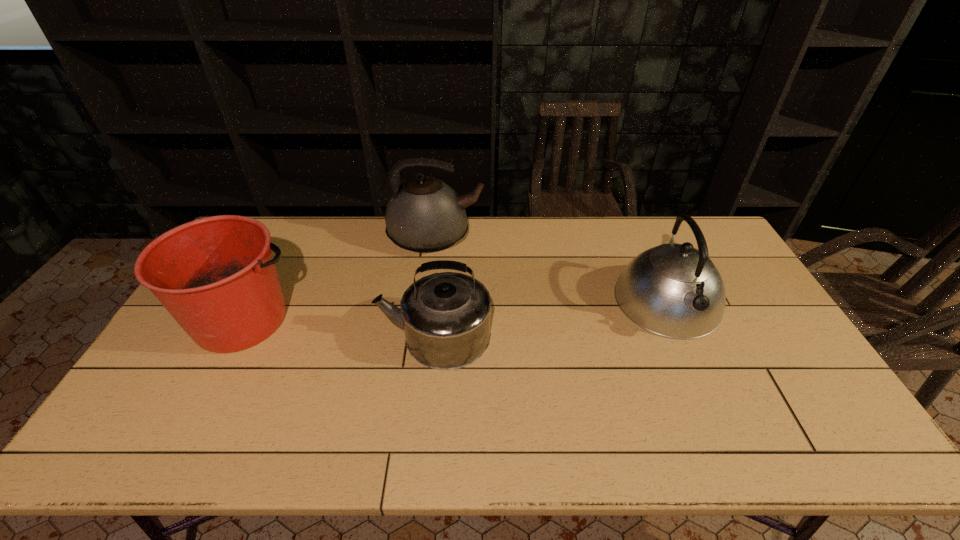
The image size is (960, 540). I want to click on the farthest kettle, so click(x=424, y=215).

Image resolution: width=960 pixels, height=540 pixels. I want to click on the rightmost kettle, so click(674, 290).

Where is `the leftmost object`? the leftmost object is located at coordinates (216, 276).

What are the coordinates of `vacant space situated 0.310m at the spout of the farthest kettle` in the screenshot? It's located at (569, 237).

The height and width of the screenshot is (540, 960). What are the coordinates of `vacant space located from the spout of the rightmost object` in the screenshot? It's located at (730, 442).

This screenshot has height=540, width=960. I want to click on free space located 0.350m on the back of the leftmost object, so click(x=297, y=221).

The height and width of the screenshot is (540, 960). I want to click on object that is at the far edge, so click(x=424, y=215).

What are the coordinates of `object located in the left edge section of the desktop` in the screenshot? It's located at (216, 276).

Where is `object present at the right edge`? object present at the right edge is located at coordinates (674, 290).

Find the location of `vacant area at the far edge`. vacant area at the far edge is located at coordinates (656, 244).